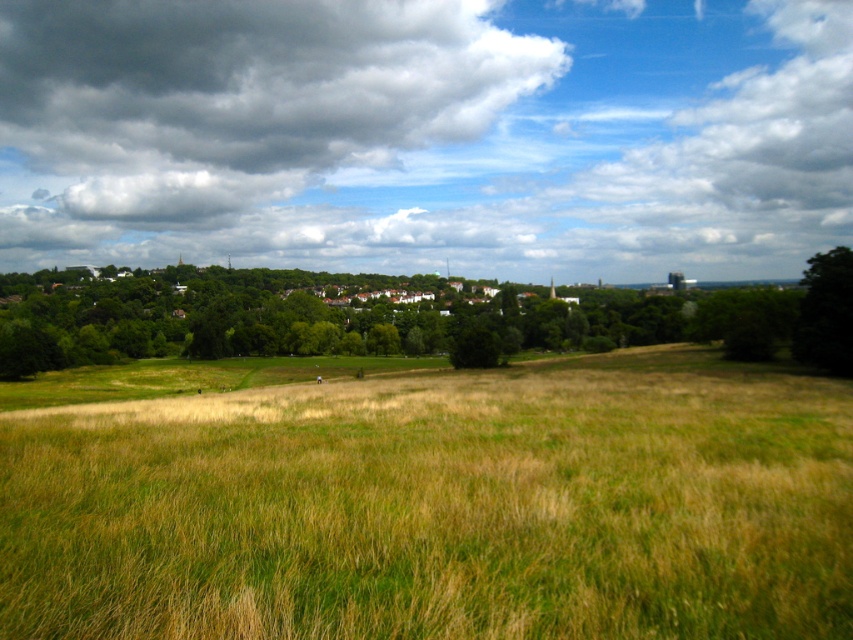
In order to click on green grassy field at center in this screenshot , I will do `click(440, 506)`.

Which is behind, point (398, 522) or point (846, 364)?

Point (846, 364)

Image resolution: width=853 pixels, height=640 pixels. Identify the location of green grassy field at center. (440, 506).

Which is more to the left, green grassy field at center or dark gray fluffy cloud at upper center?

dark gray fluffy cloud at upper center

Is point (103, 522) in front of point (235, 4)?

Yes, it is.

Where is `green grassy field at center`? The image size is (853, 640). green grassy field at center is located at coordinates (440, 506).

Who is lower down, green leafy tree at upper center or green leafy tree at right?

green leafy tree at right is below.

Between point (718, 320) and point (804, 275), which one is positioned in front?

Point (804, 275)

Find the location of a particular element. green leafy tree at upper center is located at coordinates pos(401,317).